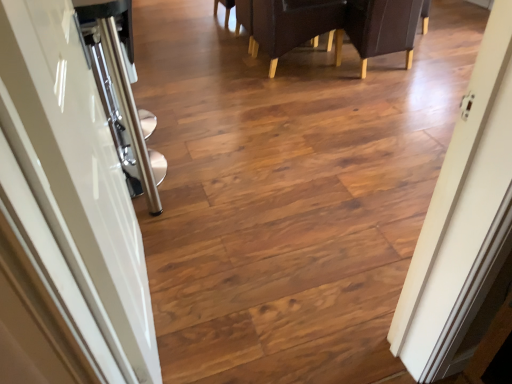
Question: From the image's perspective, is glossy white door at left above or below leather-like dark brown chair at upper center?

Choices:
 (A) below
 (B) above

Answer: (A)

Question: Would you say glossy white door at left is to the left or to the right of leather-like dark brown chair at upper center in the picture?

Choices:
 (A) left
 (B) right

Answer: (A)

Question: Which of these objects is positioned farthest from the dark brown leather armchair at upper center, acting as the first armchair starting from the left?

Choices:
 (A) glossy white door at left
 (B) leather-like dark brown chair at upper center
 (C) dark brown leather armchair at upper right, the second armchair from the left

Answer: (A)

Question: Considering the real-world distances, which object is farthest from the leather-like dark brown chair at upper center?

Choices:
 (A) glossy white door at left
 (B) dark brown leather armchair at upper right, positioned as the first armchair in right-to-left order
 (C) dark brown leather armchair at upper center, arranged as the 2th armchair when viewed from the right

Answer: (A)